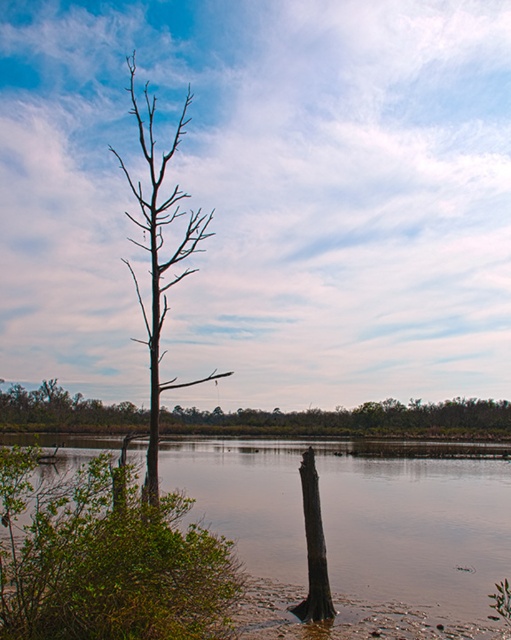
You are a hiker who has just arrived at the lakeshore and notices the brown wood tree at center and the brown rough tree trunk at center. Which object is located to the left side of the other?

The brown wood tree at center is positioned on the left side of brown rough tree trunk at center.